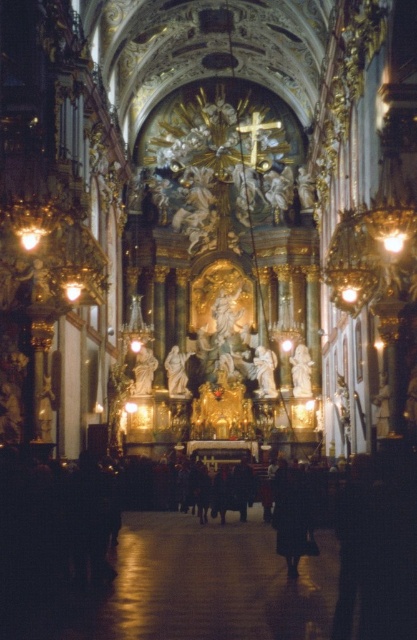
From the picture: You are standing inside the church and notice a specific point marked at coordinates [291,515]. Based on the scene description, can you identify what object this point is located on?

The point is located on the dark matte coat at center.

From the picture: You are standing at the entrance of the church and see both the dark matte coat at center and the white marble statue at center. Which object is nearer to you?

The dark matte coat at center is closer to the viewer than the white marble statue at center.

You are an interior designer planning to install a new lighting fixture above the dark matte coat at center and the white marble statue at center. Which object requires a taller fixture to avoid obstruction?

The white marble statue at center requires a taller fixture because it is taller than the dark matte coat at center.